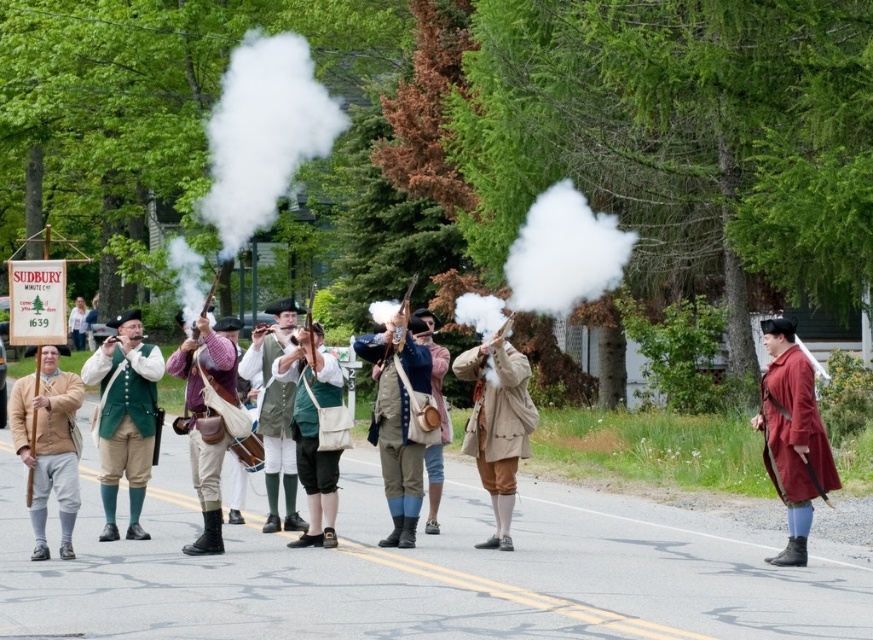
Describe the element at coordinates (263, 132) in the screenshot. This screenshot has width=873, height=640. I see `white smoke at center` at that location.

Between point (242, 232) and point (125, 410), which one is positioned behind?

The point (125, 410) is behind.

Find the location of a particular element. The image size is (873, 640). white smoke at center is located at coordinates (263, 132).

Does point (121, 461) come in front of point (280, 410)?

That is True.

Does point (152, 378) come behind point (265, 532)?

No, it is in front of (265, 532).

Who is more distant from viewer, (104, 380) or (275, 428)?

The point (275, 428) is more distant.

At what (x,y) coordinates should I click in order to perform the action: click on matte green vest at center. Please return your answer as a coordinate pair (x, y). The width and height of the screenshot is (873, 640). Looking at the image, I should click on (124, 417).

Is maroon wool coat at center to the right of beige wool coat at center from the viewer's perspective?

Correct, you'll find maroon wool coat at center to the right of beige wool coat at center.

Who is positioned more to the left, maroon wool coat at center or beige wool coat at center?

Positioned to the left is beige wool coat at center.

Does point (795, 410) come farther from viewer compared to point (485, 348)?

No.

The image size is (873, 640). Identify the location of maroon wool coat at center. (792, 436).